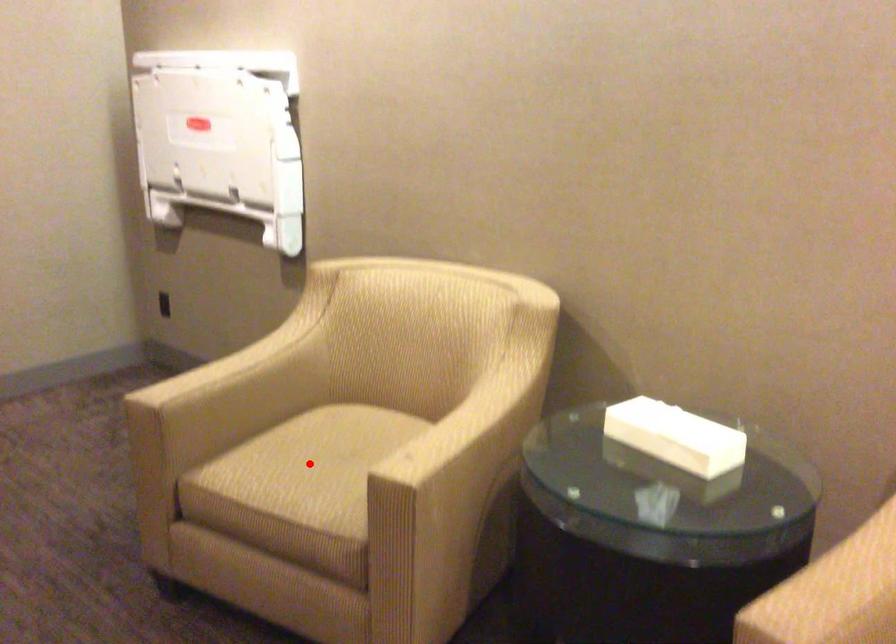
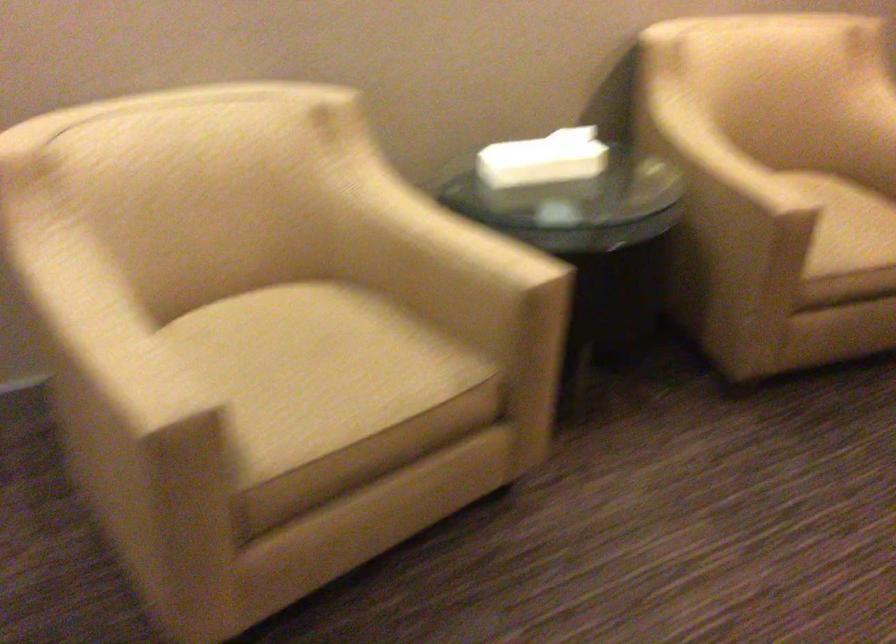
Question: I am providing you with two images of the same scene from different viewpoints. A red point is marked on the first image. Is the red point's position out of view in image 2?

Choices:
 (A) Yes
 (B) No

Answer: (B)